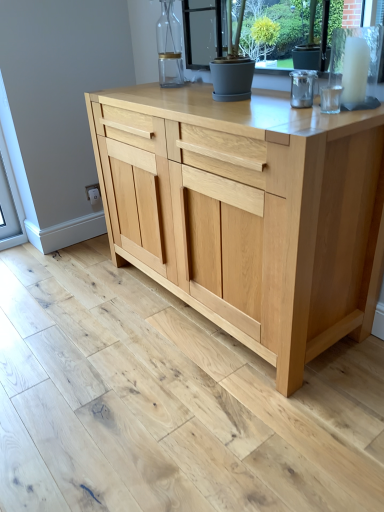
I want to click on free spot to the left of natural wood cabinet at center, so click(78, 337).